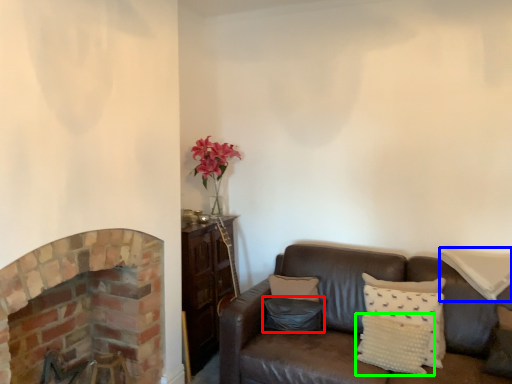
Question: Estimate the real-world distances between objects in this image. Which object is closer to pillow (highlighted by a red box), pillow (highlighted by a blue box) or pillow (highlighted by a green box)?

Choices:
 (A) pillow
 (B) pillow

Answer: (B)